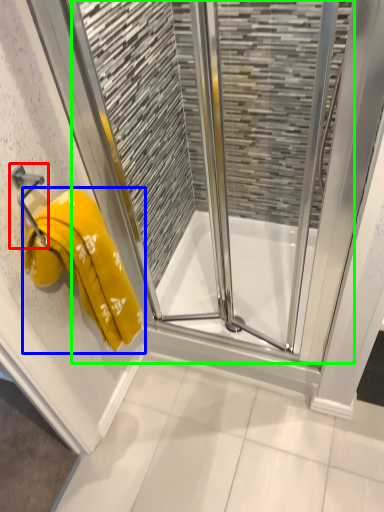
Question: Considering the real-world distances, which object is farthest from towel bar (highlighted by a red box)? towel (highlighted by a blue box) or screen door (highlighted by a green box)?

Choices:
 (A) towel
 (B) screen door

Answer: (B)